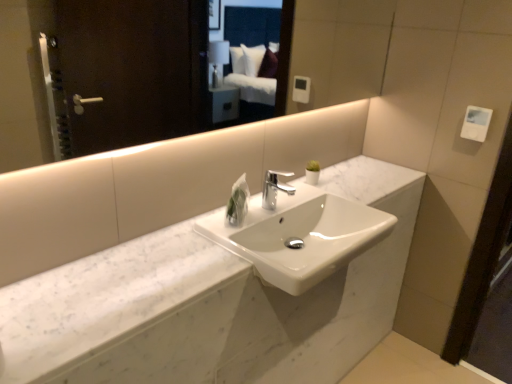
Question: From the image's perspective, is white glossy mirror at upper center located above or below polished chrome faucet at center?

Choices:
 (A) below
 (B) above

Answer: (B)

Question: Considering the relative positions of white glossy mirror at upper center and polished chrome faucet at center in the image provided, is white glossy mirror at upper center to the left or to the right of polished chrome faucet at center?

Choices:
 (A) left
 (B) right

Answer: (A)

Question: Based on their relative distances, which object is farther from the white marble counter at center?

Choices:
 (A) polished chrome faucet at center
 (B) white glossy mirror at upper center
 (C) white marble sink at center
 (D) white plastic hand dryer at upper right

Answer: (B)

Question: Based on their relative distances, which object is nearer to the white glossy mirror at upper center?

Choices:
 (A) white plastic hand dryer at upper right
 (B) white marble counter at center
 (C) polished chrome faucet at center
 (D) white marble sink at center

Answer: (A)